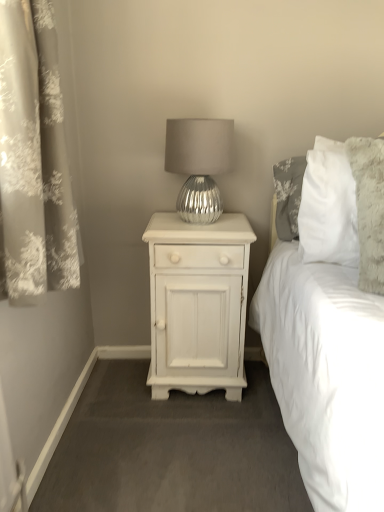
Question: Is silver metallic lamp at center in front of silvery floral curtain at left?

Choices:
 (A) no
 (B) yes

Answer: (A)

Question: Is silver metallic lamp at center oriented away from silvery floral curtain at left?

Choices:
 (A) no
 (B) yes

Answer: (A)

Question: Does silver metallic lamp at center have a lesser width compared to silvery floral curtain at left?

Choices:
 (A) no
 (B) yes

Answer: (A)

Question: Can you confirm if silver metallic lamp at center is shorter than silvery floral curtain at left?

Choices:
 (A) no
 (B) yes

Answer: (B)

Question: Is silver metallic lamp at center to the right of silvery floral curtain at left from the viewer's perspective?

Choices:
 (A) no
 (B) yes

Answer: (B)

Question: From the image's perspective, is silver metallic lamp at center below silvery floral curtain at left?

Choices:
 (A) no
 (B) yes

Answer: (A)

Question: Is the depth of silver metallic lamp at center less than that of white painted wood nightstand at center?

Choices:
 (A) no
 (B) yes

Answer: (B)

Question: Is silver metallic lamp at center facing towards white painted wood nightstand at center?

Choices:
 (A) yes
 (B) no

Answer: (B)

Question: Is silver metallic lamp at center further to the viewer compared to white painted wood nightstand at center?

Choices:
 (A) yes
 (B) no

Answer: (B)

Question: From the image's perspective, is silver metallic lamp at center under white painted wood nightstand at center?

Choices:
 (A) no
 (B) yes

Answer: (A)

Question: Does silver metallic lamp at center have a greater height compared to white painted wood nightstand at center?

Choices:
 (A) yes
 (B) no

Answer: (B)

Question: Could white painted wood nightstand at center be considered to be inside silver metallic lamp at center?

Choices:
 (A) no
 (B) yes

Answer: (A)

Question: Does white painted wood nightstand at center have a greater height compared to silver metallic lamp at center?

Choices:
 (A) yes
 (B) no

Answer: (A)